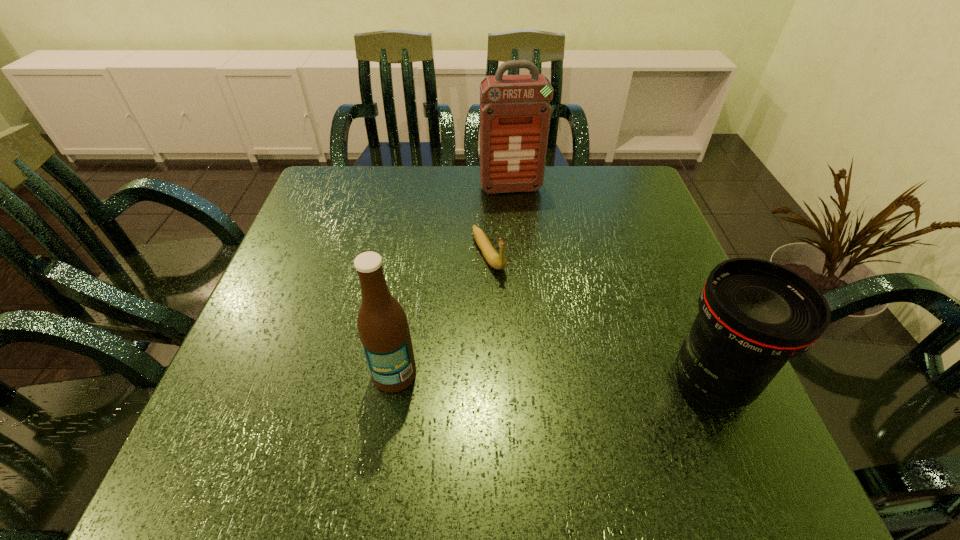
The image size is (960, 540). What are the coordinates of `vacant space that satisfies the following two spatial constraints: 1. on the back side of the shortest object; 2. on the left side of the leftmost object` in the screenshot? It's located at (414, 254).

Locate an element on the screen. free space that satisfies the following two spatial constraints: 1. on the back side of the banana; 2. on the left side of the beer bottle is located at coordinates (414, 254).